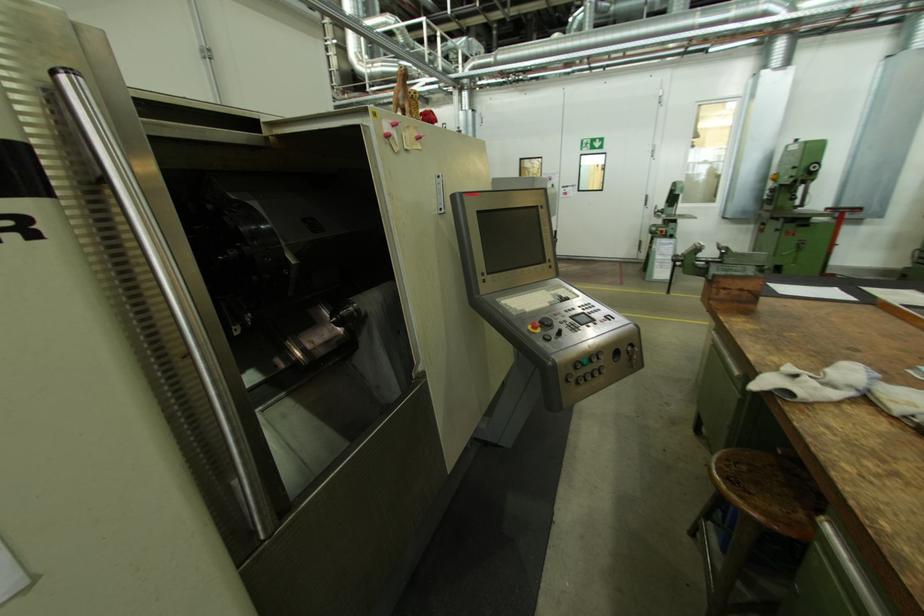
You are a GUI agent. You are given a task and a screenshot of the screen. Output one action in this format:
    pyautogui.click(x=<x>, y=<y>)
    Task: Click on the chair sitting surface
    
    Given the screenshot: What is the action you would take?
    pyautogui.click(x=768, y=490)